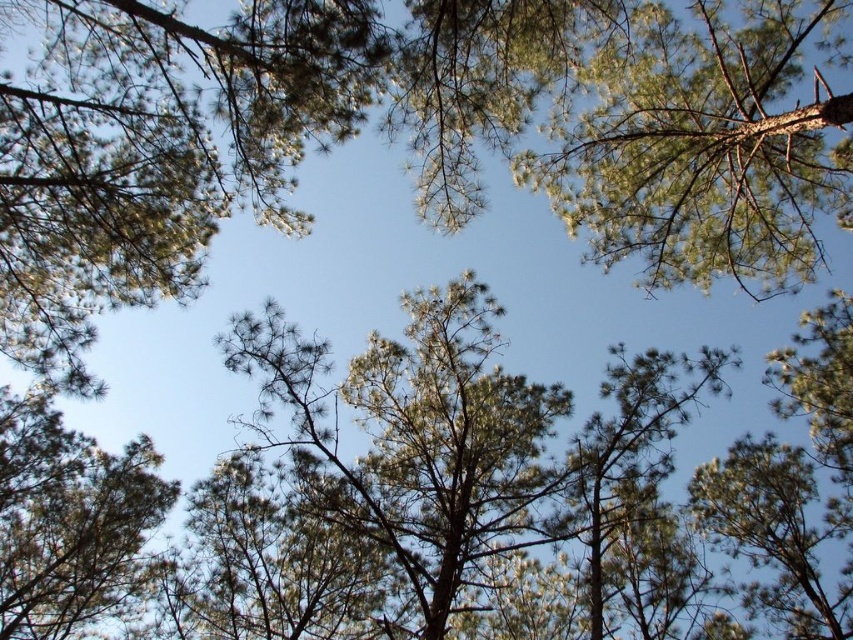
You are standing under a tall pine tree and looking up. You see a point marked at coordinates (701,147). What is located at that point?

The point at coordinates (701,147) marks green needle like at upper right.